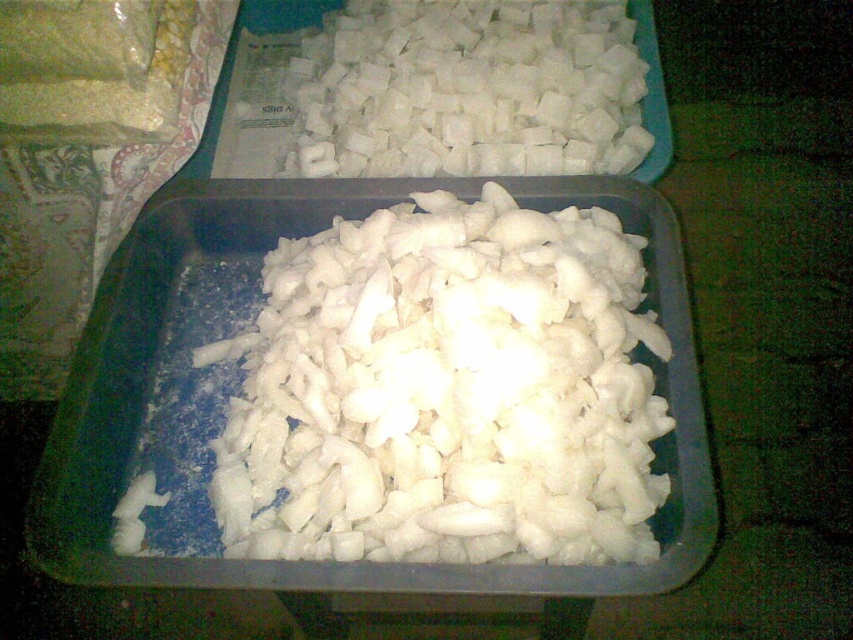
Is point (567, 241) positioned in front of point (347, 60)?

Yes, point (567, 241) is in front of point (347, 60).

Is point (271, 468) closer to viewer compared to point (549, 145)?

Yes, point (271, 468) is closer to viewer.

Where is `white matte chopped onions at center`? white matte chopped onions at center is located at coordinates (445, 390).